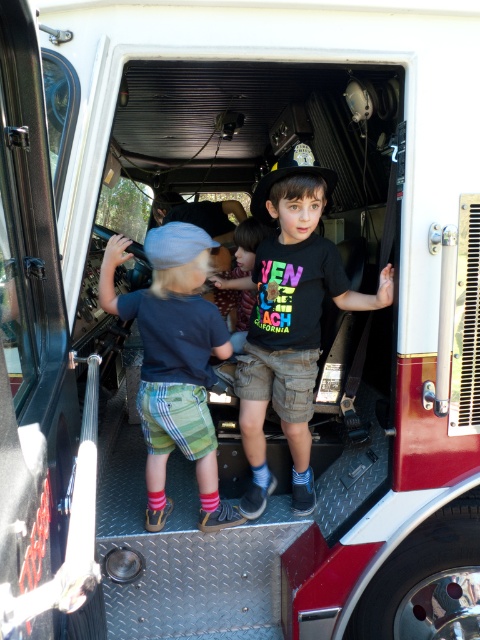
Which is more to the left, matte black shirt at center or matte blue shirt at center?

From the viewer's perspective, matte blue shirt at center appears more on the left side.

Which is above, matte black shirt at center or matte blue shirt at center?

matte black shirt at center

Between point (300, 468) and point (204, 426), which one is positioned behind?

The point (300, 468) is behind.

Identify the location of matte black shirt at center. (290, 323).